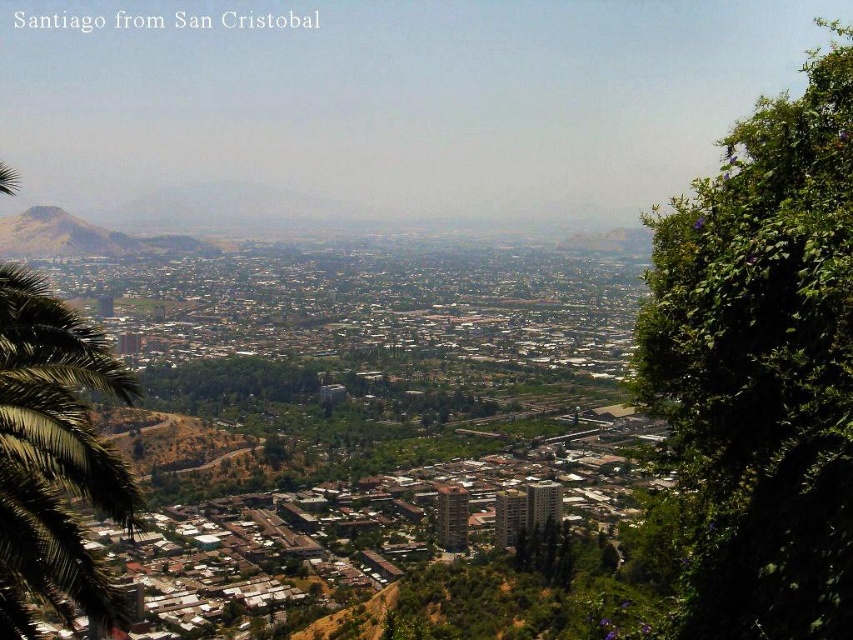
Question: Among these points, which one is farthest from the camera?

Choices:
 (A) (59, 241)
 (B) (9, 433)
 (C) (701, 595)

Answer: (A)

Question: Is green leafy tree at right bigger than green leafy palm tree at left?

Choices:
 (A) yes
 (B) no

Answer: (A)

Question: Does green leafy tree at right have a lesser width compared to rustic brown hill at left?

Choices:
 (A) no
 (B) yes

Answer: (A)

Question: Is green leafy palm tree at left positioned before rustic brown hill at left?

Choices:
 (A) yes
 (B) no

Answer: (A)

Question: Based on their relative distances, which object is nearer to the rustic brown hill at left?

Choices:
 (A) green leafy tree at right
 (B) green leafy palm tree at left

Answer: (B)

Question: Which is farther from the green leafy palm tree at left?

Choices:
 (A) rustic brown hill at left
 (B) green leafy tree at right

Answer: (B)